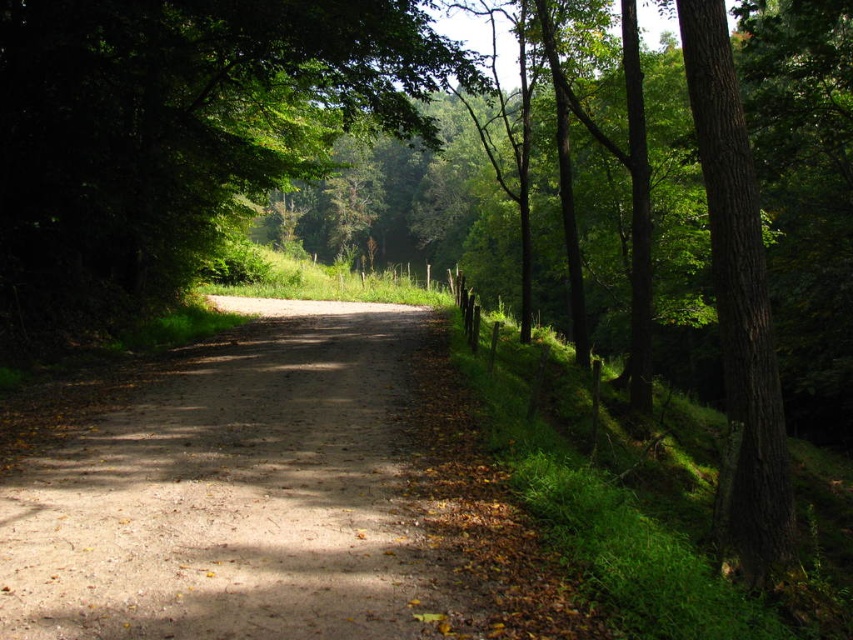
Question: Which point is farther to the camera?

Choices:
 (A) green rough bark tree at right
 (B) green leafy tree at center

Answer: (B)

Question: Does green leafy tree at center appear on the right side of green rough bark tree at right?

Choices:
 (A) no
 (B) yes

Answer: (A)

Question: Considering the real-world distances, which object is closest to the green rough bark tree at right?

Choices:
 (A) green leafy tree at center
 (B) dirt path at center

Answer: (B)

Question: Among these points, which one is farthest from the camera?

Choices:
 (A) (345, 540)
 (B) (722, 56)
 (C) (184, 170)

Answer: (C)

Question: Does dirt path at center appear on the right side of green rough bark tree at right?

Choices:
 (A) yes
 (B) no

Answer: (B)

Question: Considering the relative positions of dirt path at center and green leafy tree at center in the image provided, where is dirt path at center located with respect to green leafy tree at center?

Choices:
 (A) below
 (B) above

Answer: (A)